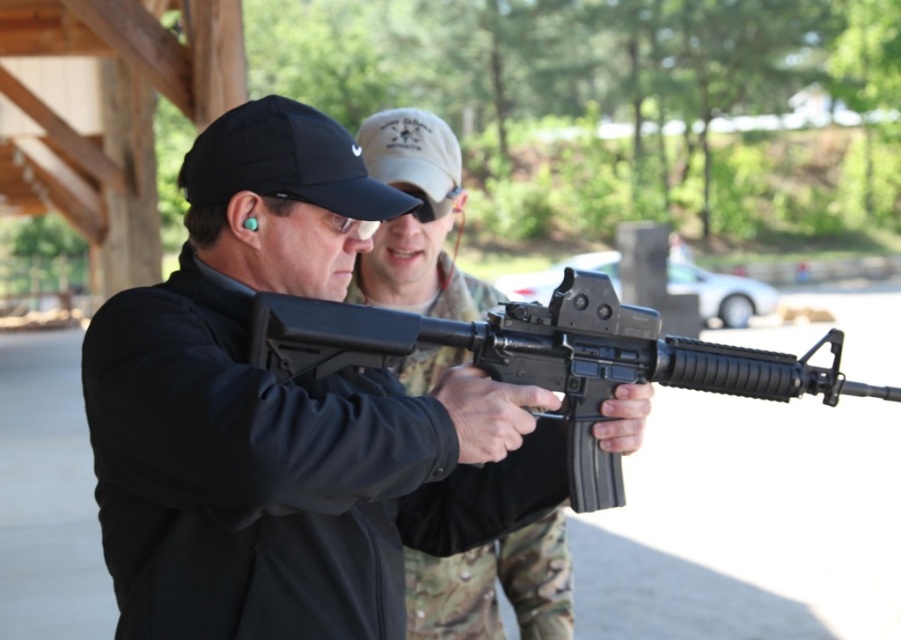
You are a safety inspector checking a shooting range. You need to ensure that the black matte rifle at center is positioned at the center of the shooting lane. The shooting lane has a target at point 0.5,0.5. Is the rifle positioned correctly?

The black matte rifle at center is at point [547,358], which is slightly to the right and above the target at [450,320]. Therefore, it is not positioned correctly at the center of the shooting lane.

You are a safety inspector at a shooting range. You need to ensure that all firearms are properly secured in their designated storage area. The storage area is located at point 0.2, 0.3. The point where the matte black rifle at center is currently located is at point [417,221]. Is the matte black rifle at center properly secured in the designated storage area?

The matte black rifle at center is located at point [417,221], which is not the designated storage area at point 0.2, 0.3. Therefore, the rifle is not properly secured in the designated storage area.